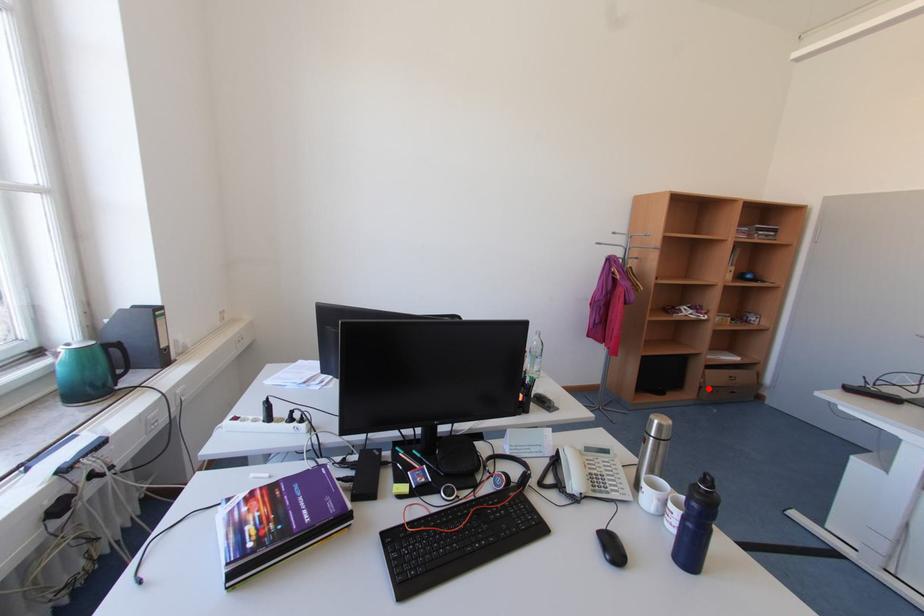
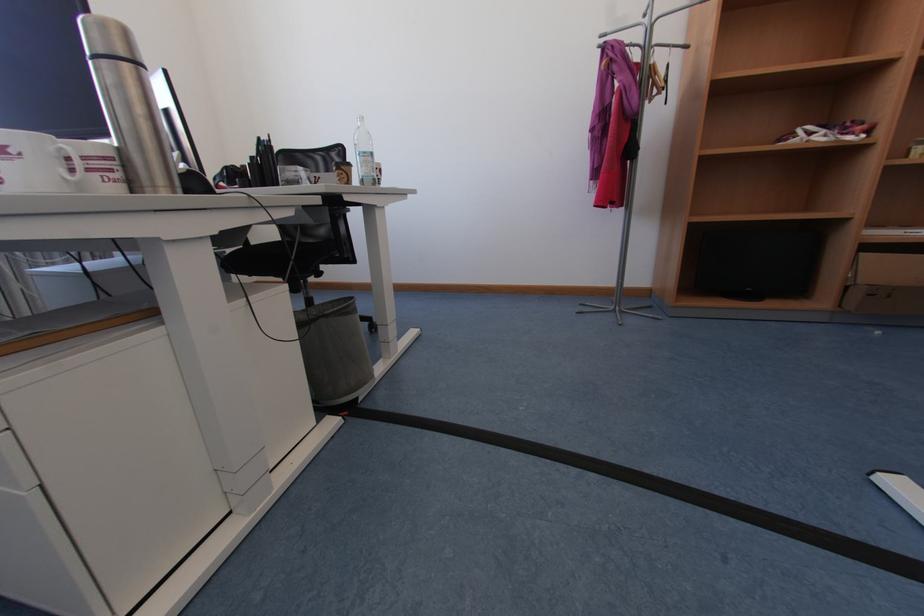
Question: A red point is marked in image1. In image2, is the corresponding 3D point closer to the camera or farther? Reply with the corresponding letter.

Choices:
 (A) The corresponding 3D point is closer.
 (B) The corresponding 3D point is farther.

Answer: (B)